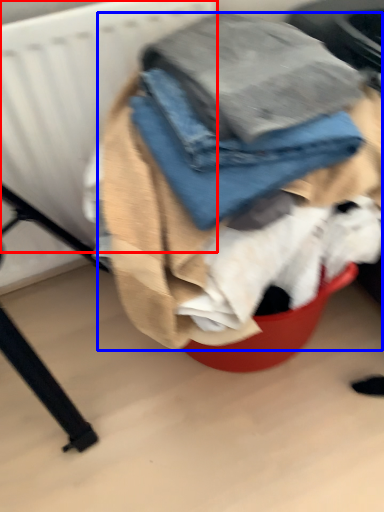
Question: Which object is further to the camera taking this photo, radiator (highlighted by a red box) or laundry (highlighted by a blue box)?

Choices:
 (A) radiator
 (B) laundry

Answer: (A)